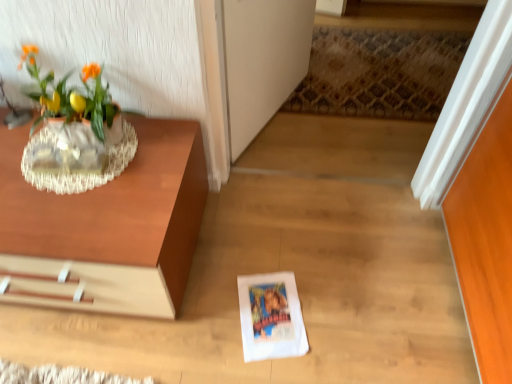
Image resolution: width=512 pixels, height=384 pixels. In order to click on free space in front of transparent glass door at center in this screenshot , I will do `click(300, 152)`.